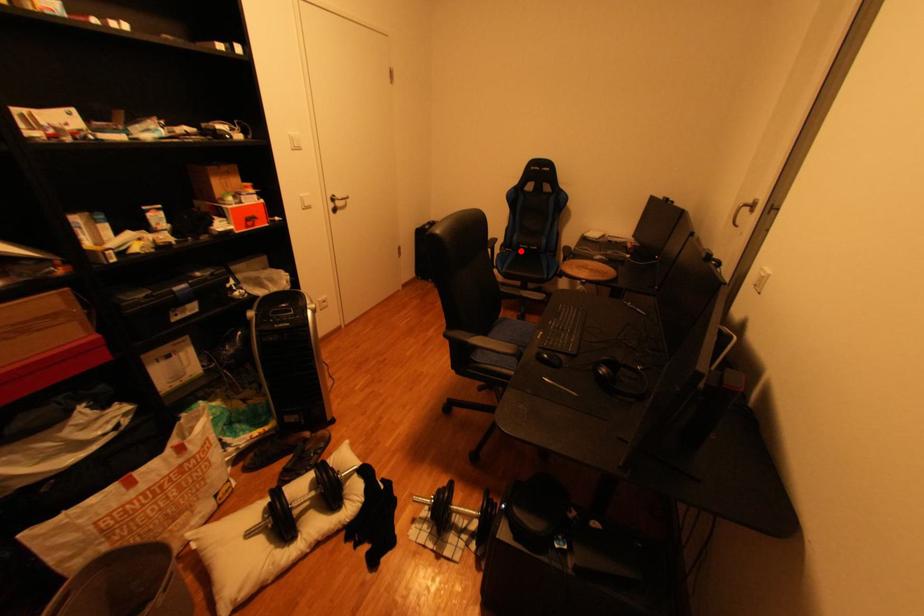
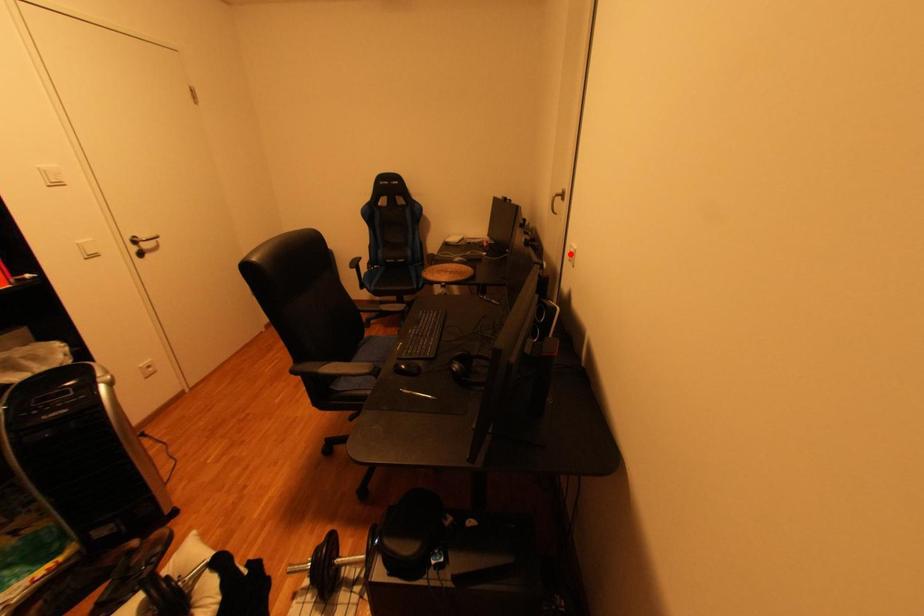
I am providing you with two images of the same scene from different viewpoints. A red point is marked on the first image and another point is marked on the second image. Does the point marked in image1 correspond to the same location as the one in image2?

No